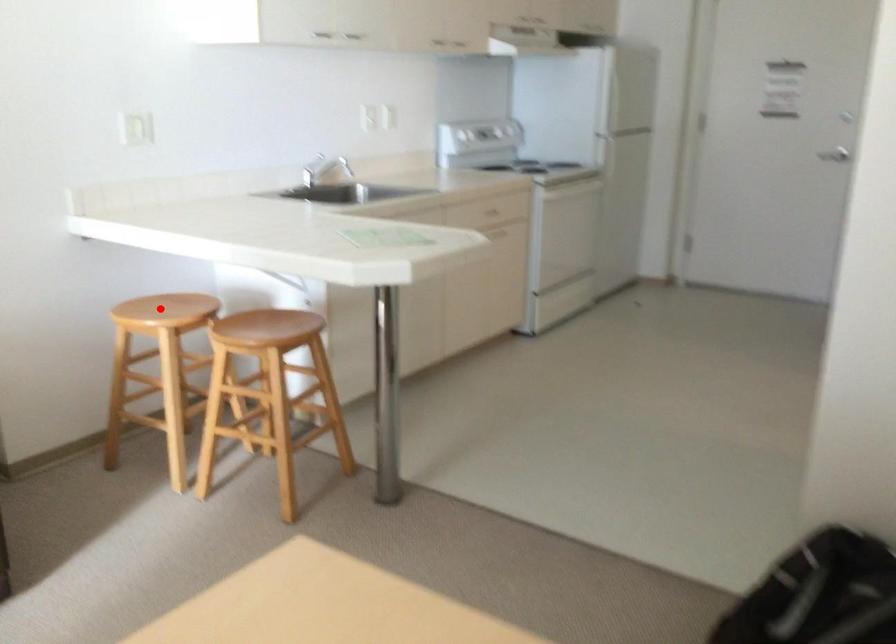
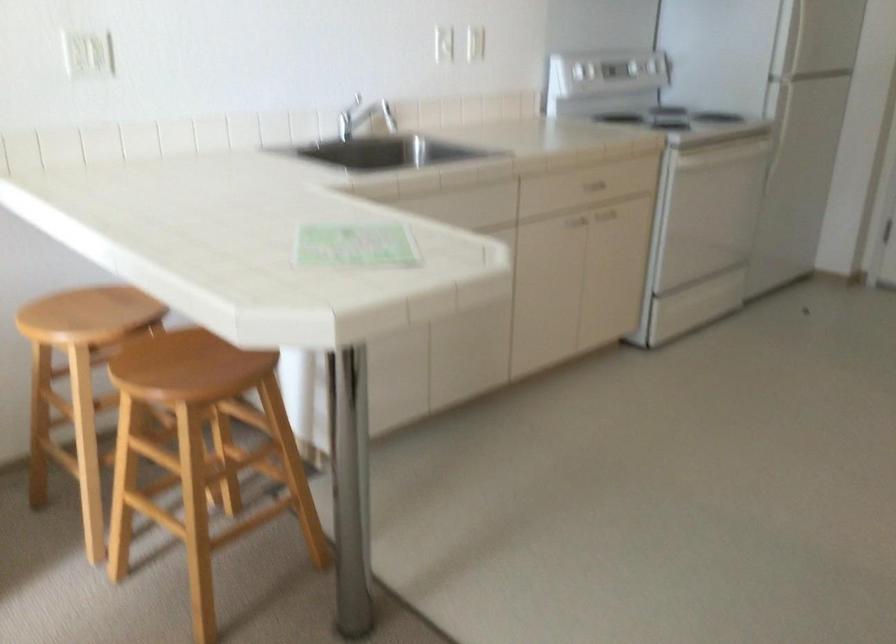
Where in the second image is the point corresponding to the highlighted location from the first image?

(82, 315)